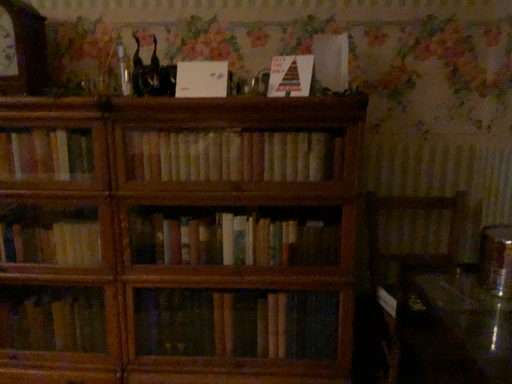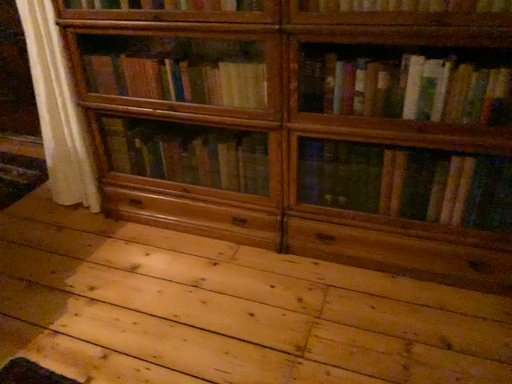
Question: Which way did the camera rotate in the video?

Choices:
 (A) rotated right
 (B) rotated left

Answer: (B)